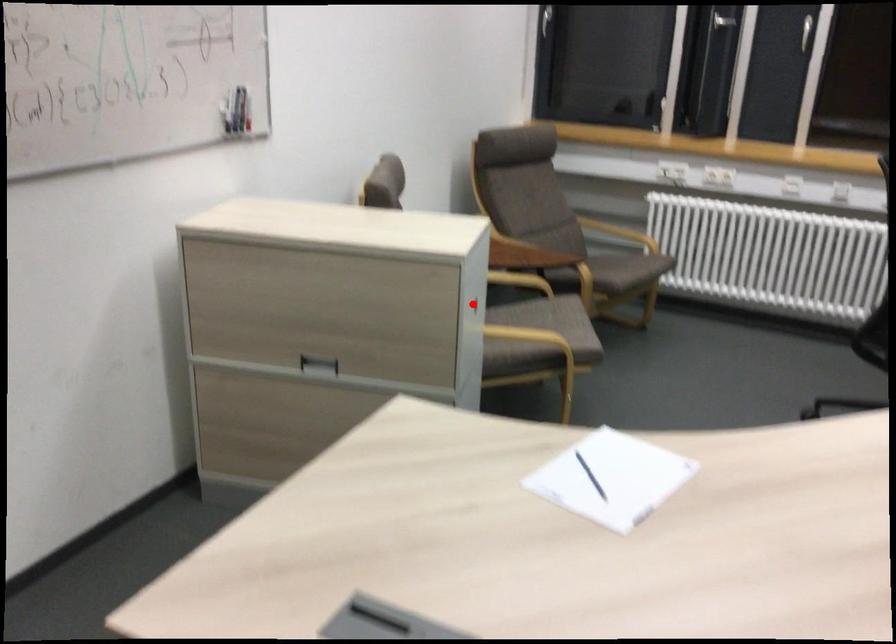
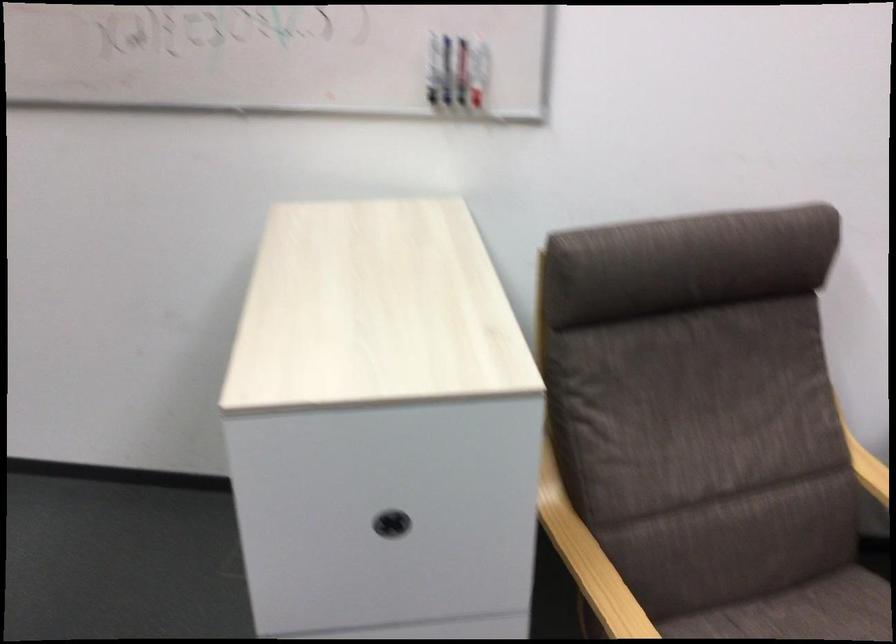
Where in the second image is the point corresponding to the highlighted location from the first image?

(391, 524)